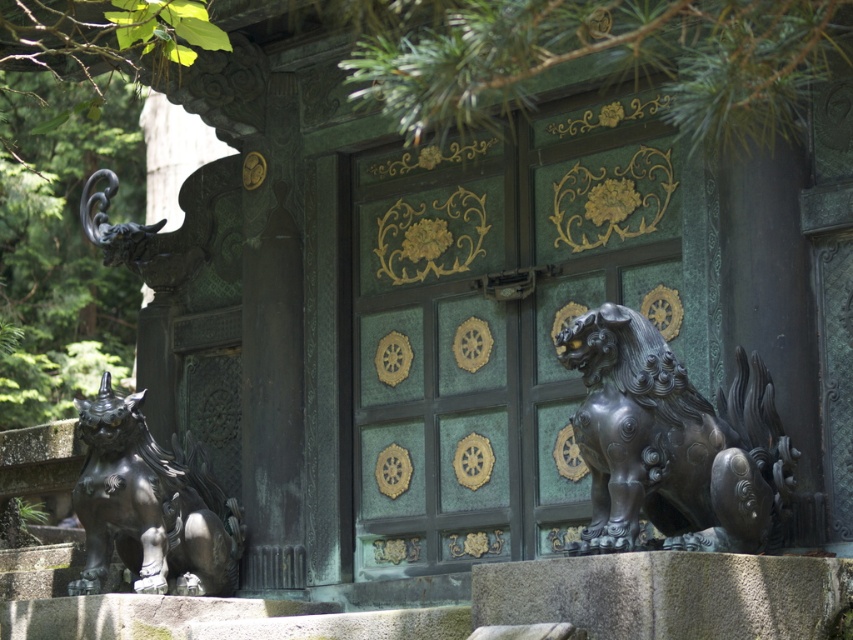
Which of these two, green patinated metal door at center or black polished stone lion at right, stands shorter?

black polished stone lion at right is shorter.

Image resolution: width=853 pixels, height=640 pixels. Find the location of `green patinated metal door at center`. green patinated metal door at center is located at coordinates (498, 324).

Which of these two, green patinated metal door at center or bronze statue at lower left, stands taller?

green patinated metal door at center

Is point (453, 285) closer to camera compared to point (151, 515)?

No, (453, 285) is behind (151, 515).

Describe the element at coordinates (498, 324) in the screenshot. This screenshot has height=640, width=853. I see `green patinated metal door at center` at that location.

This screenshot has height=640, width=853. What are the coordinates of `green patinated metal door at center` in the screenshot? It's located at (498, 324).

Which is more to the left, black polished stone lion at right or bronze statue at lower left?

bronze statue at lower left

Which of these two, black polished stone lion at right or bronze statue at lower left, stands shorter?

With less height is black polished stone lion at right.

Which is behind, point (757, 460) or point (131, 426)?

Positioned behind is point (131, 426).

You are a GUI agent. You are given a task and a screenshot of the screen. Output one action in this format:
    pyautogui.click(x=<x>, y=<y>)
    Task: Click on the black polished stone lion at right
    
    Given the screenshot: What is the action you would take?
    pyautogui.click(x=672, y=444)